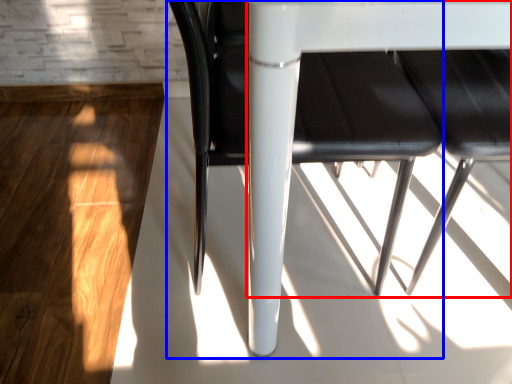
Question: Which object appears farthest to the camera in this image, table (highlighted by a red box) or chair (highlighted by a blue box)?

Choices:
 (A) table
 (B) chair

Answer: (B)